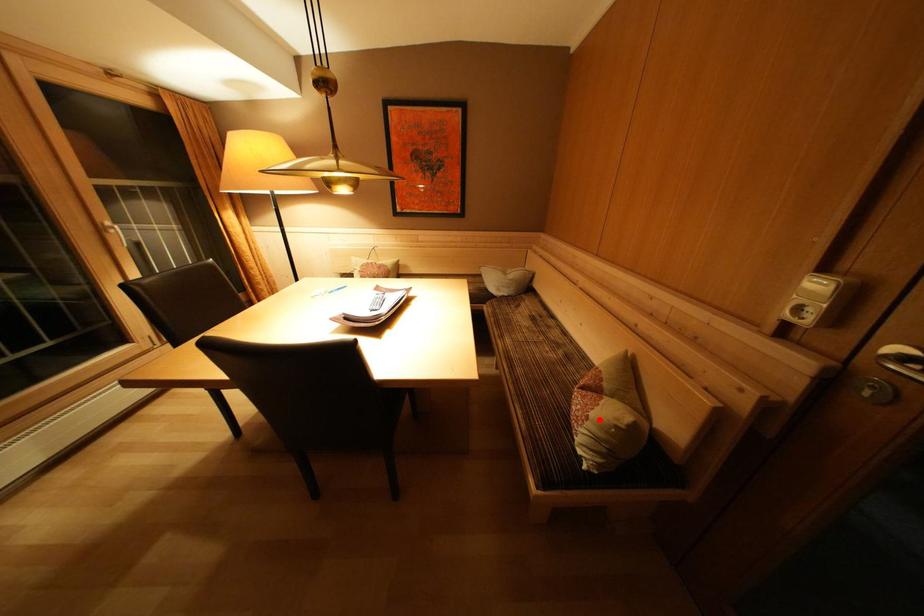
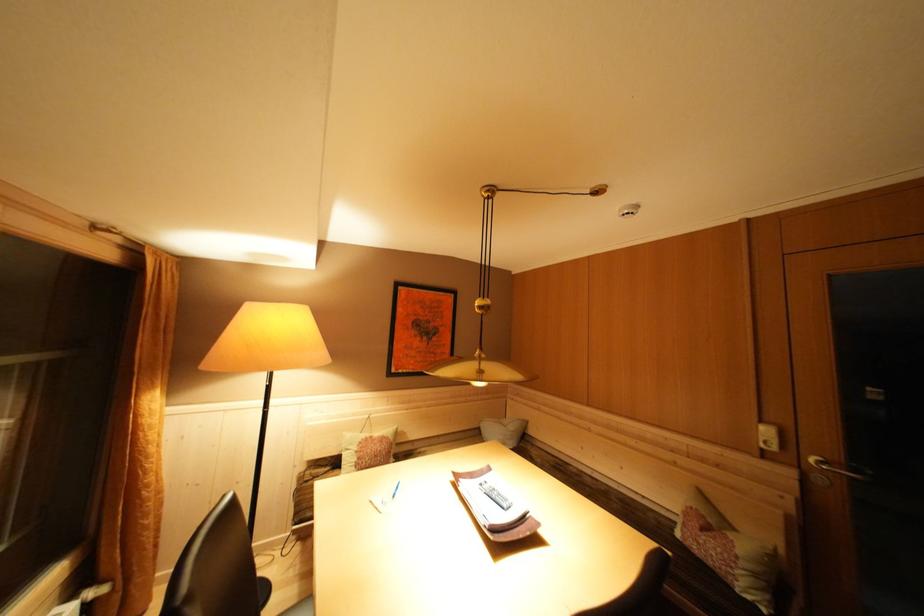
Question: I am providing you with two images of the same scene from different viewpoints. A red point is shown in image1. For the corresponding object point in image2, is it positioned nearer or farther from the camera?

Choices:
 (A) Nearer
 (B) Farther

Answer: (A)